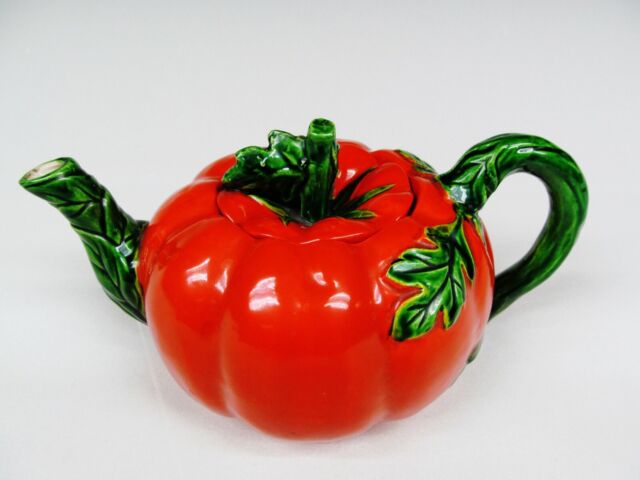
The height and width of the screenshot is (480, 640). I want to click on tea pot handle, so click(x=568, y=188).